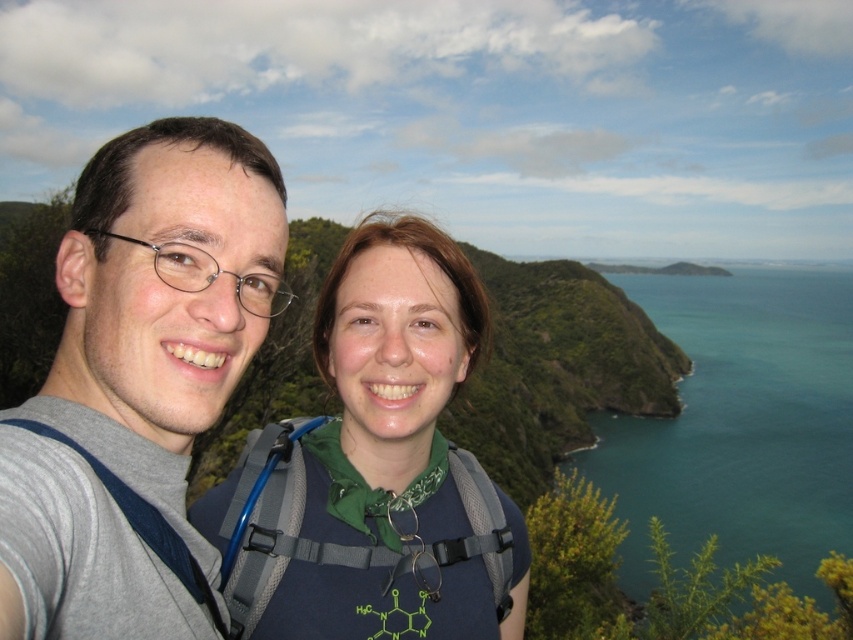
Question: Which of the following is the closest to the observer?

Choices:
 (A) (727, 461)
 (B) (450, 259)

Answer: (B)

Question: Among these objects, which one is farthest from the camera?

Choices:
 (A) blue fabric backpack at center
 (B) gray fabric shirt at left

Answer: (A)

Question: Does gray fabric shirt at left have a larger size compared to teal glossy water at upper right?

Choices:
 (A) yes
 (B) no

Answer: (B)

Question: Based on their relative distances, which object is farther from the blue fabric backpack at center?

Choices:
 (A) teal glossy water at upper right
 (B) gray fabric shirt at left

Answer: (A)

Question: Does gray fabric shirt at left have a larger size compared to teal glossy water at upper right?

Choices:
 (A) no
 (B) yes

Answer: (A)

Question: Is gray fabric shirt at left thinner than blue fabric backpack at center?

Choices:
 (A) no
 (B) yes

Answer: (B)